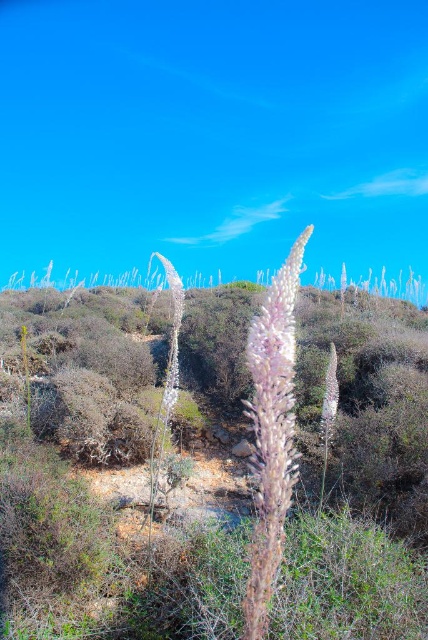
How far apart are fuzzy pink flower at center and white fuzzy plant at center?

fuzzy pink flower at center and white fuzzy plant at center are 2.38 meters apart.

Who is more distant from viewer, (279, 499) or (324, 385)?

The point (324, 385) is more distant.

Between point (291, 442) and point (335, 404), which one is positioned in front?

Point (335, 404)

This screenshot has height=640, width=428. Find the location of `fuzzy pink flower at center`. fuzzy pink flower at center is located at coordinates (272, 432).